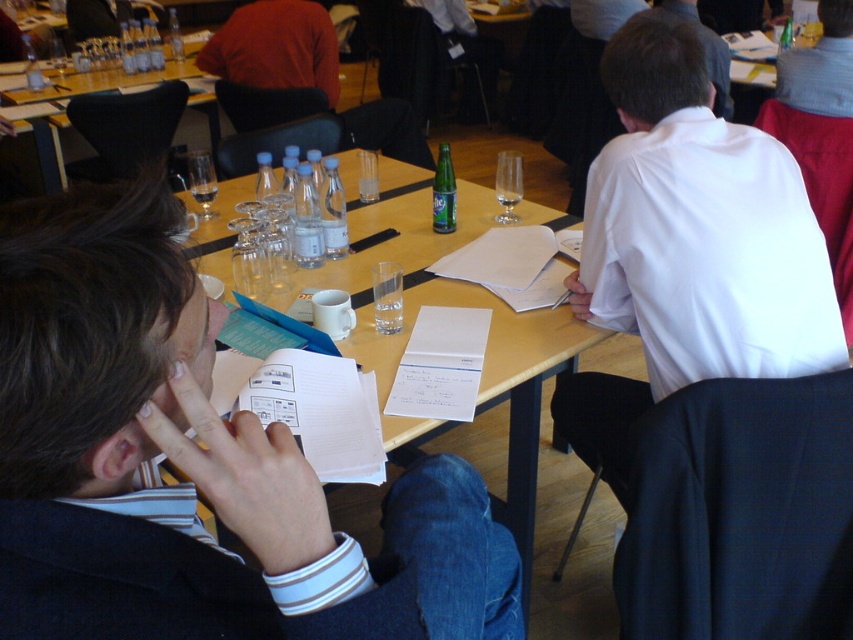
You are standing in the conference room and want to place a folder on the wooden table at center. However, there is a matte orange shirt at upper center in your way. Can you reach the table without moving the shirt?

The wooden table at center is closer to the viewer than the matte orange shirt at upper center, so you can reach the wooden table at center without needing to move the matte orange shirt at upper center.

You are standing in the conference room and notice the wooden table at center and the matte orange shirt at upper center. Which object is positioned to the right of the other?

The wooden table at center is to the right of the matte orange shirt at upper center.